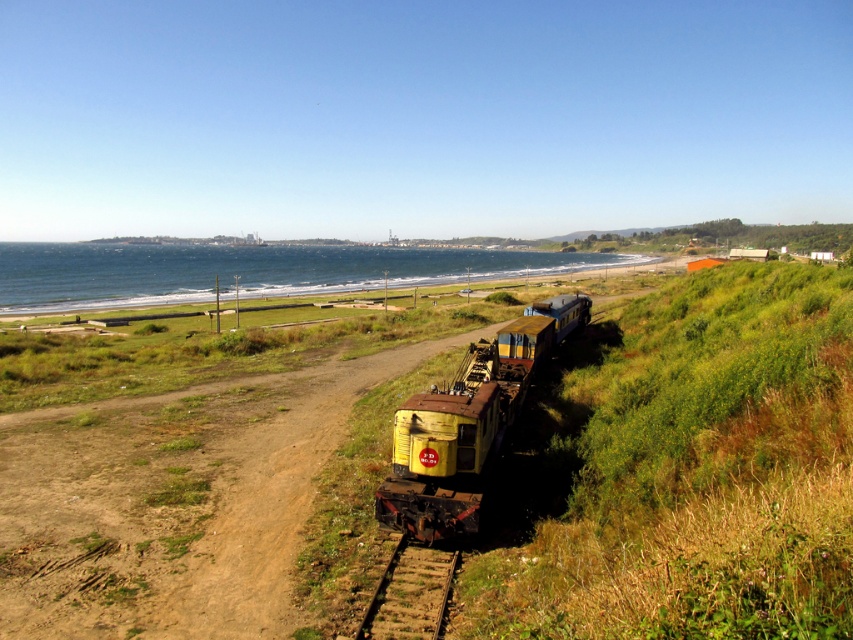
Which is above, rusty yellow train at center-right or brown dirt train track at center?

rusty yellow train at center-right

From the picture: Between rusty yellow train at center-right and brown dirt train track at center, which one is positioned lower?

brown dirt train track at center is lower down.

Locate an element on the screen. The image size is (853, 640). rusty yellow train at center-right is located at coordinates (466, 422).

Is point (694, 508) less distant than point (440, 451)?

Yes, it is.

Who is more distant from viewer, (845, 378) or (416, 508)?

Point (416, 508)

Where is `green grassy at lower right`? green grassy at lower right is located at coordinates (682, 470).

Which of these two, green grassy at lower right or brown dirt train track at center, stands taller?

green grassy at lower right

Does green grassy at lower right have a lesser height compared to brown dirt train track at center?

In fact, green grassy at lower right may be taller than brown dirt train track at center.

Image resolution: width=853 pixels, height=640 pixels. In order to click on green grassy at lower right in this screenshot , I will do `click(682, 470)`.